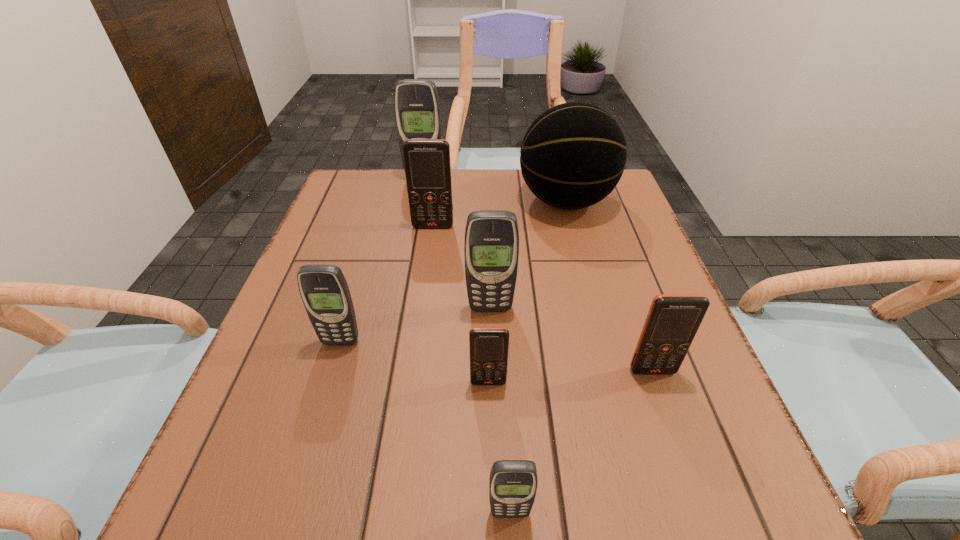
This screenshot has height=540, width=960. I want to click on free spot at the left edge of the desktop, so click(329, 352).

This screenshot has width=960, height=540. Find the location of `vacant space at the right edge of the desktop`. vacant space at the right edge of the desktop is located at coordinates (603, 272).

Identify the location of free space at the far left corner of the desktop. This screenshot has width=960, height=540. coord(337,203).

You are a GUI agent. You are given a task and a screenshot of the screen. Output one action in this format:
    pyautogui.click(x=<x>, y=<y>)
    Task: Click on the free space at the near left corner
    This screenshot has width=960, height=540.
    Given the screenshot: What is the action you would take?
    pyautogui.click(x=304, y=529)

Find the location of a particular element. Image resolution: width=960 pixels, height=540 pixels. free point at the near right corner is located at coordinates (734, 529).

Where is `blank region between the nearest gray cellular telephone and the fifth farthest cellular telephone`? blank region between the nearest gray cellular telephone and the fifth farthest cellular telephone is located at coordinates (581, 442).

Locate an element on the screen. The width and height of the screenshot is (960, 540). free space between the second biggest gray cellular telephone and the farthest gray cellular telephone is located at coordinates (457, 244).

This screenshot has width=960, height=540. Identify the location of free space between the leftmost object and the smallest gray cellular telephone. (425, 427).

Where is `blank region between the farthest orange cellular telephone and the fifth farthest cellular telephone`? The height and width of the screenshot is (540, 960). blank region between the farthest orange cellular telephone and the fifth farthest cellular telephone is located at coordinates (542, 299).

What are the coordinates of `vacant area that lies between the leftmost gray cellular telephone and the black basketball` in the screenshot? It's located at (453, 272).